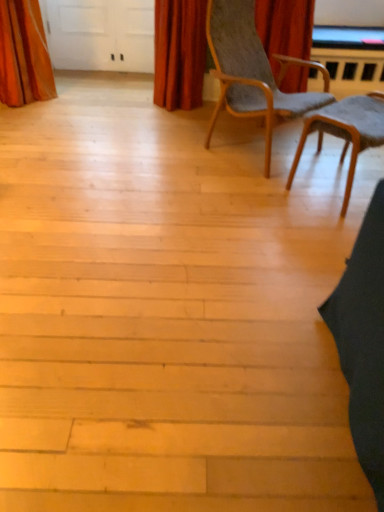
Question: Is light brown wood chair at center, the 2th chair positioned from the right, inside or outside of orange velvet curtain at upper left, which appears as the 1th curtain when viewed from the left?

Choices:
 (A) outside
 (B) inside

Answer: (A)

Question: From a real-world perspective, relative to orange velvet curtain at upper left, the 2th curtain in the right-to-left sequence, is light brown wood chair at center, marked as the first chair in a left-to-right arrangement, vertically above or below?

Choices:
 (A) above
 (B) below

Answer: (A)

Question: Which object is the farthest from the velvet red curtain at upper center, the 2th curtain from the left?

Choices:
 (A) orange velvet curtain at upper left, the 2th curtain in the right-to-left sequence
 (B) light brown wood chair at center, the 2th chair positioned from the right
 (C) wooden textured chair at center right, the second chair from the left

Answer: (C)

Question: Which of these objects is positioned farthest from the wooden textured chair at center right, the second chair from the left?

Choices:
 (A) light brown wood chair at center, the 2th chair positioned from the right
 (B) velvet red curtain at upper center, the 1th curtain when ordered from right to left
 (C) orange velvet curtain at upper left, which appears as the 1th curtain when viewed from the left

Answer: (C)